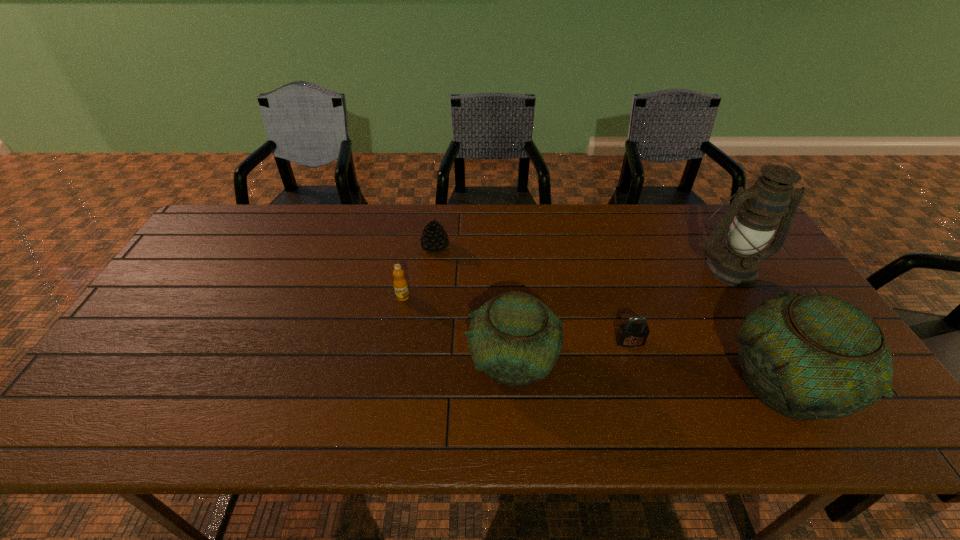
Where is `free space at the near edge of the desktop`? free space at the near edge of the desktop is located at coordinates (323, 383).

This screenshot has width=960, height=540. I want to click on free space at the left edge of the desktop, so click(233, 261).

At what (x,y) coordinates should I click in order to perform the action: click on vacant space at the far left corner of the desktop. Please return your answer as a coordinate pair (x, y). This screenshot has height=540, width=960. Looking at the image, I should click on (245, 208).

Locate an element on the screen. vacant point located between the right pottery and the fifth object from right to left is located at coordinates (610, 316).

Find the location of a particular element. The width and height of the screenshot is (960, 540). empty location between the fifth shortest object and the fourth shortest object is located at coordinates (648, 373).

At what (x,y) coordinates should I click in order to perform the action: click on free space between the right pottery and the third farthest object. Please return your answer as a coordinate pair (x, y). The width and height of the screenshot is (960, 540). Looking at the image, I should click on (594, 341).

The width and height of the screenshot is (960, 540). Find the location of `free space that is in between the second tallest object and the third object from right to left`. free space that is in between the second tallest object and the third object from right to left is located at coordinates (708, 363).

The height and width of the screenshot is (540, 960). In order to click on free space between the pinecone and the left pottery in this screenshot , I will do `click(473, 304)`.

Find the location of `vacant area between the fourth object from left to right and the right pottery`. vacant area between the fourth object from left to right and the right pottery is located at coordinates (708, 363).

Identify the location of vacant area that lies between the pinecone and the padlock. (533, 294).